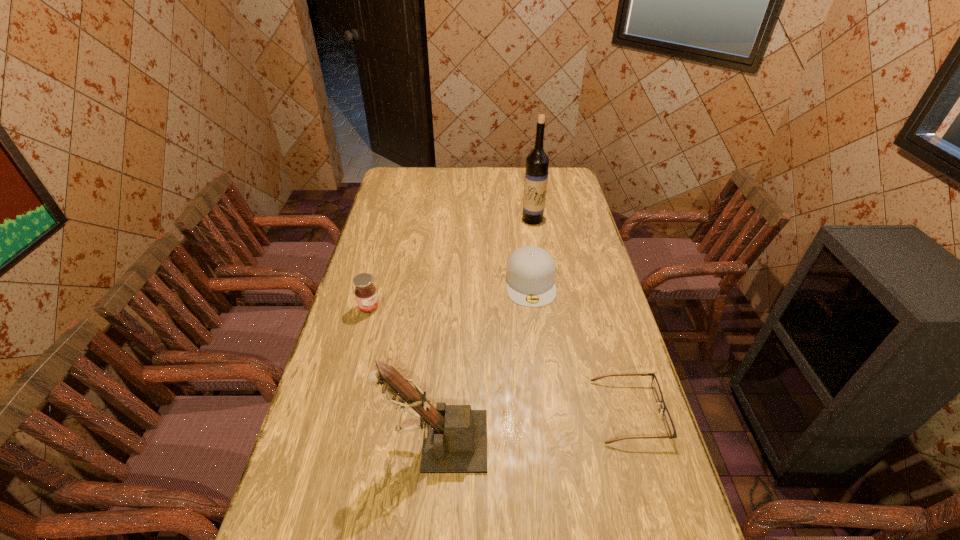
What are the coordinates of `unoccupied area between the figurine and the leftmost object` in the screenshot? It's located at (402, 374).

Where is `unoccupied area between the figurine and the fourth tallest object`? unoccupied area between the figurine and the fourth tallest object is located at coordinates point(483,361).

You are a GUI agent. You are given a task and a screenshot of the screen. Output one action in this format:
    pyautogui.click(x=<x>, y=<y>)
    Task: Click on the blank region between the spectacles and the figurine
    Image resolution: width=960 pixels, height=540 pixels.
    Given the screenshot: What is the action you would take?
    pyautogui.click(x=532, y=426)

Image resolution: width=960 pixels, height=540 pixels. I want to click on vacant space that is in between the second object from left to right and the tallest object, so click(484, 330).

Locate an element on the screen. The height and width of the screenshot is (540, 960). vacant point located between the third shortest object and the wine bottle is located at coordinates (451, 264).

Where is `object that stands as the third closest to the cap`? This screenshot has width=960, height=540. object that stands as the third closest to the cap is located at coordinates (455, 437).

Select which object is the fourth closest to the shortest object. Please provide its 2D coordinates. Your answer should be formatted as a tuple, i.e. [(x, y)], where the tuple contains the x and y coordinates of a point satisfying the conditions above.

[(537, 162)]

Locate an element on the screen. The width and height of the screenshot is (960, 540). blank area in the image that satisfies the following two spatial constraints: 1. on the front side of the fourth tallest object; 2. on the front-facing side of the rightmost object is located at coordinates (547, 411).

Where is `free spot that satisfies the following two spatial constraints: 1. on the back side of the tallest object; 2. on the right side of the cap`? free spot that satisfies the following two spatial constraints: 1. on the back side of the tallest object; 2. on the right side of the cap is located at coordinates (522, 219).

Where is `free space that satisfies the following two spatial constraints: 1. on the front side of the rightmost object; 2. on the front-facing side of the farthest object`? The width and height of the screenshot is (960, 540). free space that satisfies the following two spatial constraints: 1. on the front side of the rightmost object; 2. on the front-facing side of the farthest object is located at coordinates (564, 411).